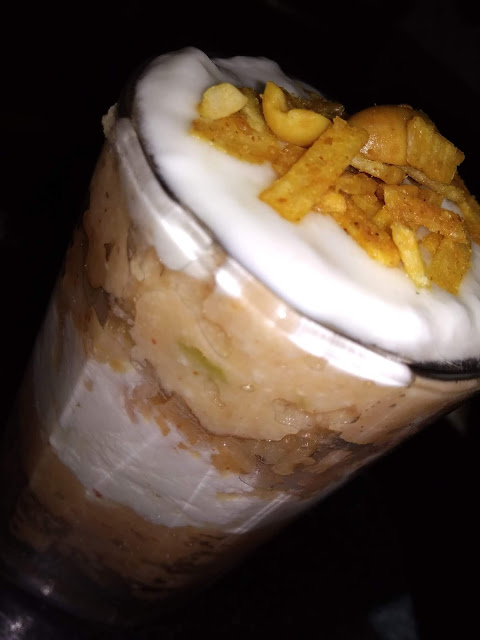
Locate an element on the screen. rim of tall glass is located at coordinates (183, 205).